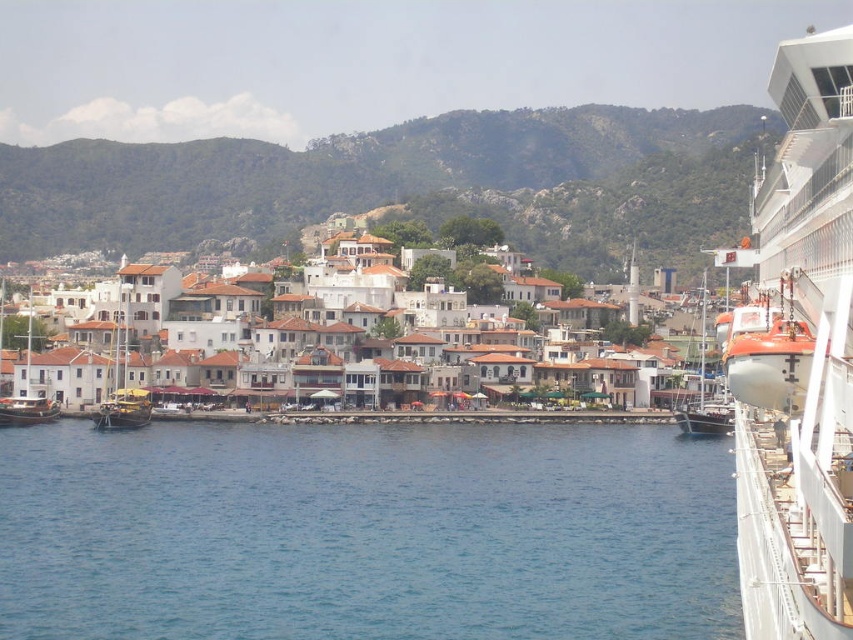
Which is above, blue water at center or wooden sailboat at left?

wooden sailboat at left is higher up.

Does blue water at center have a greater width compared to wooden sailboat at left?

Yes.

Which is behind, point (471, 632) or point (106, 406)?

Point (106, 406)

At what (x,y) coordinates should I click in order to perform the action: click on blue water at center. Please return your answer as a coordinate pair (x, y). Looking at the image, I should click on pyautogui.click(x=364, y=532).

Can you confirm if white matte buildings at center is positioned below wooden sailboat at lower left?

Incorrect, white matte buildings at center is not positioned below wooden sailboat at lower left.

Who is more distant from viewer, [108,314] or [36,413]?

Positioned behind is point [108,314].

Who is more distant from viewer, (x=180, y=276) or (x=51, y=416)?

Positioned behind is point (x=180, y=276).

Where is `white matte buildings at center`? The width and height of the screenshot is (853, 640). white matte buildings at center is located at coordinates (373, 304).

In order to click on wooden sailboat at lower left in this screenshot , I will do `click(27, 396)`.

Is point (0, 340) farther from viewer compared to point (692, 419)?

Yes, point (0, 340) is behind point (692, 419).

At what (x,y) coordinates should I click in order to perform the action: click on wooden sailboat at lower left. Please return your answer as a coordinate pair (x, y). Looking at the image, I should click on (27, 396).